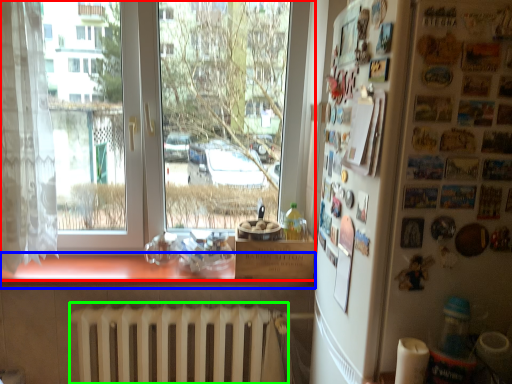
Question: Which is nearer to the window (highlighted by a red box)? counter top (highlighted by a blue box) or radiator (highlighted by a green box).

Choices:
 (A) counter top
 (B) radiator

Answer: (B)